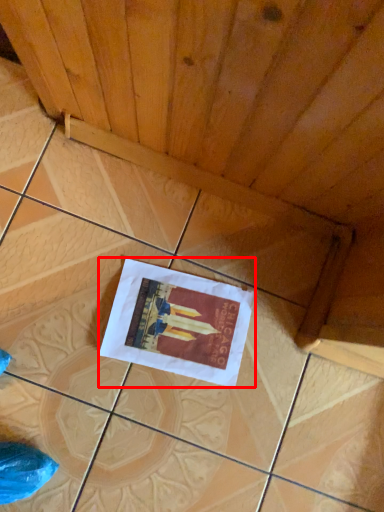
Question: From the image, what is the correct spatial relationship of poster (annotated by the red box) in relation to plywood?

Choices:
 (A) right
 (B) left

Answer: (A)